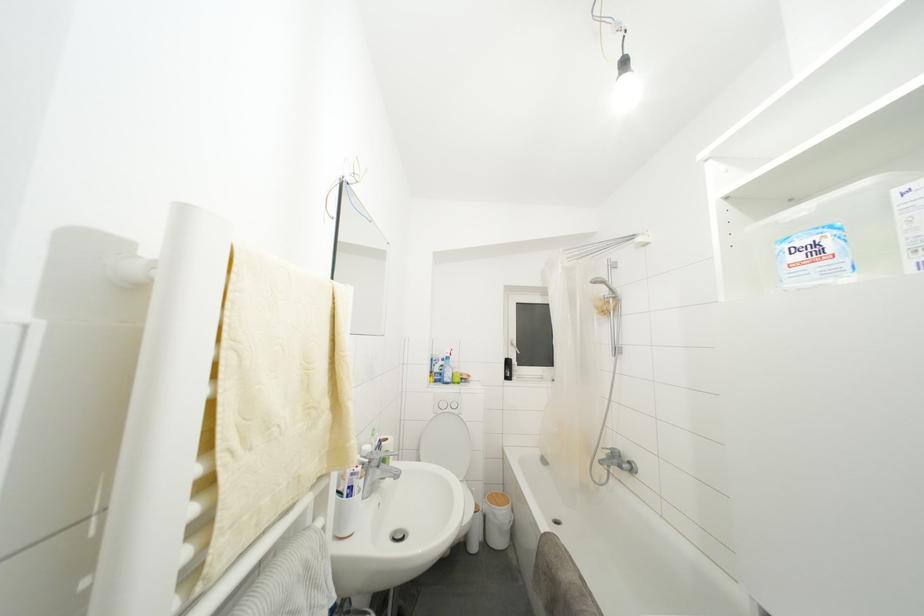
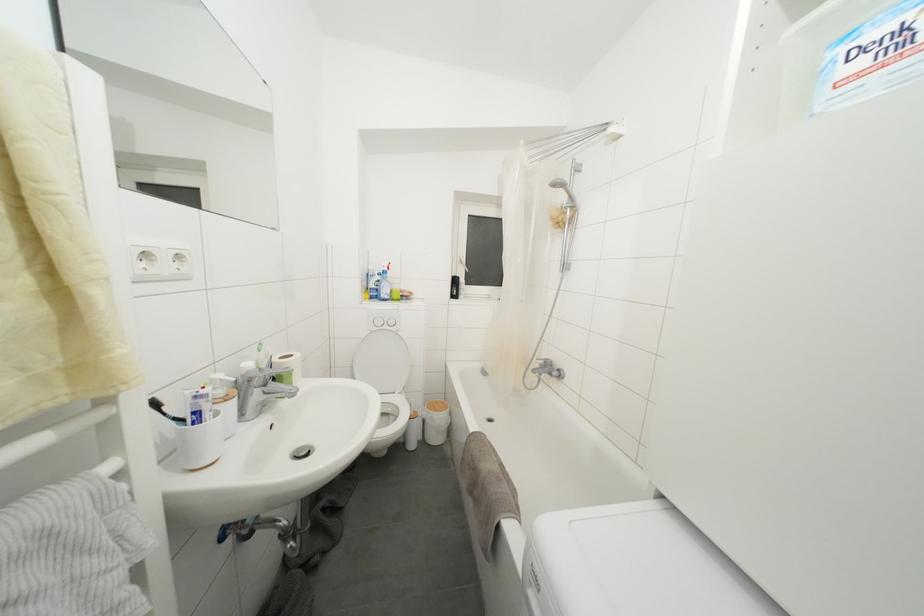
Locate, in the second image, the point that corresponds to (359,495) in the first image.

(211, 419)